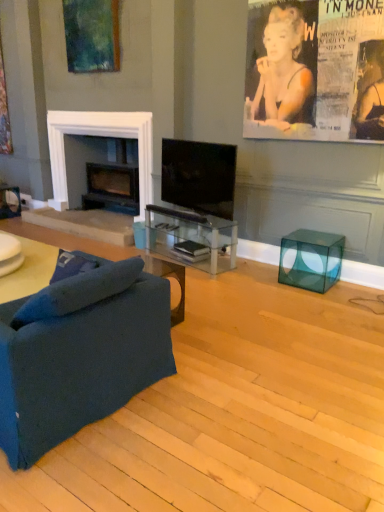
What are the coordinates of `black matte fireplace at left` in the screenshot? It's located at (100, 136).

What do you see at coordinates (191, 237) in the screenshot? Image resolution: width=384 pixels, height=512 pixels. I see `transparent glass tv stand at center` at bounding box center [191, 237].

Identify the location of matte black book at center, which ranks as the 2th magazine in bottom-to-top order. (191, 248).

What do you see at coordinates (191, 252) in the screenshot?
I see `matte black magazine at center, marked as the 2th magazine in a top-to-bottom arrangement` at bounding box center [191, 252].

Measure the distance between matte paper poster at upper right and camera.

matte paper poster at upper right and camera are 11.55 feet apart from each other.

Where is `velvet blue studio couch at lower left`? The width and height of the screenshot is (384, 512). velvet blue studio couch at lower left is located at coordinates 79,351.

Considering the sizes of objects matte black magazine at center, the 1th magazine from the bottom, and teal textured canvas at upper left in the image provided, who is taller, matte black magazine at center, the 1th magazine from the bottom, or teal textured canvas at upper left?

With more height is teal textured canvas at upper left.

Could you tell me if matte black magazine at center, the 1th magazine from the bottom, is turned towards teal textured canvas at upper left?

No, matte black magazine at center, the 1th magazine from the bottom, is not turned towards teal textured canvas at upper left.

Is matte black magazine at center, marked as the 2th magazine in a top-to-bottom arrangement, closer to the viewer compared to teal textured canvas at upper left?

Yes, it is.

Is matte black magazine at center, marked as the 2th magazine in a top-to-bottom arrangement, to the right of teal textured canvas at upper left from the viewer's perspective?

Yes.

Between teal textured canvas at upper left and matte paper poster at upper right, which one has less height?

Standing shorter between the two is teal textured canvas at upper left.

From a real-world perspective, is teal textured canvas at upper left beneath matte paper poster at upper right?

Actually, teal textured canvas at upper left is physically above matte paper poster at upper right in the real world.

Are teal textured canvas at upper left and matte paper poster at upper right beside each other?

There is a gap between teal textured canvas at upper left and matte paper poster at upper right.

In the scene shown: How far apart are velvet blue studio couch at lower left and black matte fireplace at left?

A distance of 3.41 meters exists between velvet blue studio couch at lower left and black matte fireplace at left.

From the image's perspective, is velvet blue studio couch at lower left positioned above or below black matte fireplace at left?

velvet blue studio couch at lower left is below black matte fireplace at left.

Does velvet blue studio couch at lower left have a larger size compared to black matte fireplace at left?

Yes, velvet blue studio couch at lower left is bigger than black matte fireplace at left.

In the scene shown: How many degrees apart are the facing directions of velvet blue studio couch at lower left and black matte fireplace at left?

93.8 degrees.

Between black matte fireplace at left and transparent glass tv stand at center, which one has smaller size?

Smaller between the two is transparent glass tv stand at center.

Can you confirm if black matte fireplace at left is thinner than transparent glass tv stand at center?

Incorrect, the width of black matte fireplace at left is not less than that of transparent glass tv stand at center.

Who is more distant, black matte fireplace at left or transparent glass tv stand at center?

black matte fireplace at left.

Between matte paper poster at upper right and transparent glass cube at lower right, which one has smaller width?

Thinner between the two is matte paper poster at upper right.

How different are the orientations of matte paper poster at upper right and transparent glass cube at lower right in degrees?

There is a 0.472-degree angle between the facing directions of matte paper poster at upper right and transparent glass cube at lower right.

Is transparent glass cube at lower right inside matte paper poster at upper right?

Definitely not — transparent glass cube at lower right is not inside matte paper poster at upper right.

Considering the relative sizes of teal textured canvas at upper left and transparent glass tv stand at center in the image provided, is teal textured canvas at upper left wider than transparent glass tv stand at center?

No, teal textured canvas at upper left is not wider than transparent glass tv stand at center.

Is teal textured canvas at upper left facing away from transparent glass tv stand at center?

No, teal textured canvas at upper left is not facing the opposite direction of transparent glass tv stand at center.

Does teal textured canvas at upper left touch transparent glass tv stand at center?

teal textured canvas at upper left is not next to transparent glass tv stand at center, and they're not touching.

Between matte black book at center, which ranks as the 2th magazine in bottom-to-top order, and transparent glass cube at lower right, which one has larger width?

Wider between the two is transparent glass cube at lower right.

Does matte black book at center, which ranks as the 2th magazine in bottom-to-top order, have a greater height compared to transparent glass cube at lower right?

No, matte black book at center, which ranks as the 2th magazine in bottom-to-top order, is not taller than transparent glass cube at lower right.

How different are the orientations of matte black book at center, which ranks as the 2th magazine in bottom-to-top order, and transparent glass cube at lower right in degrees?

There is a 13.6-degree angle between the facing directions of matte black book at center, which ranks as the 2th magazine in bottom-to-top order, and transparent glass cube at lower right.

Locate an element on the screen. This screenshot has height=512, width=384. the 2nd magazine in front of the teal textured canvas at upper left is located at coordinates (191, 252).

You are a GUI agent. You are given a task and a screenshot of the screen. Output one action in this format:
    pyautogui.click(x=<x>, y=<y>)
    Task: Click on the picture frame above the matte paper poster at upper right (from the image's perspective)
    This screenshot has width=384, height=512.
    Given the screenshot: What is the action you would take?
    pyautogui.click(x=92, y=35)

Looking at the image, which one is located further to black matte fireplace at left, teal textured canvas at upper left or transparent glass cube at lower right?

Among the two, transparent glass cube at lower right is located further to black matte fireplace at left.

Which object lies further to the anchor point transparent glass tv stand at center, black matte fireplace at left or black glossy tv at center?

The object further to transparent glass tv stand at center is black matte fireplace at left.

Estimate the real-world distances between objects in this image. Which object is further from black matte fireplace at left, velvet blue studio couch at lower left or transparent glass tv stand at center?

Among the two, velvet blue studio couch at lower left is located further to black matte fireplace at left.

Based on their spatial positions, is transparent glass tv stand at center or teal textured canvas at upper left further from black matte fireplace at left?

Among the two, transparent glass tv stand at center is located further to black matte fireplace at left.

Estimate the real-world distances between objects in this image. Which object is closer to teal textured canvas at upper left, transparent glass tv stand at center or black matte fireplace at left?

The object closer to teal textured canvas at upper left is black matte fireplace at left.

When comparing their distances from matte black book at center, marked as the 1th magazine in a top-to-bottom arrangement, does teal textured canvas at upper left or transparent glass tv stand at center seem further?

Based on the image, teal textured canvas at upper left appears to be further to matte black book at center, marked as the 1th magazine in a top-to-bottom arrangement.

Estimate the real-world distances between objects in this image. Which object is closer to black glossy tv at center, transparent glass tv stand at center or matte paper poster at upper right?

transparent glass tv stand at center lies closer to black glossy tv at center than the other object.

From the image, which object appears to be nearer to black matte fireplace at left, matte paper poster at upper right or black glossy tv at center?

Based on the image, black glossy tv at center appears to be nearer to black matte fireplace at left.

The width and height of the screenshot is (384, 512). Find the location of `poster page positioned between velvet blue studio couch at lower left and black glossy tv at center from near to far`. poster page positioned between velvet blue studio couch at lower left and black glossy tv at center from near to far is located at coordinates (315, 70).

Identify the location of fireplace between teal textured canvas at upper left and transparent glass tv stand at center from top to bottom. (100, 136).

Find the location of `magazine between teal textured canvas at upper left and matte black magazine at center, the 1th magazine from the bottom, in the vertical direction`. magazine between teal textured canvas at upper left and matte black magazine at center, the 1th magazine from the bottom, in the vertical direction is located at coordinates (191, 248).

What are the coordinates of `table between black glossy tv at center and matte black magazine at center, marked as the 2th magazine in a top-to-bottom arrangement, in the up-down direction` in the screenshot? It's located at (191, 237).